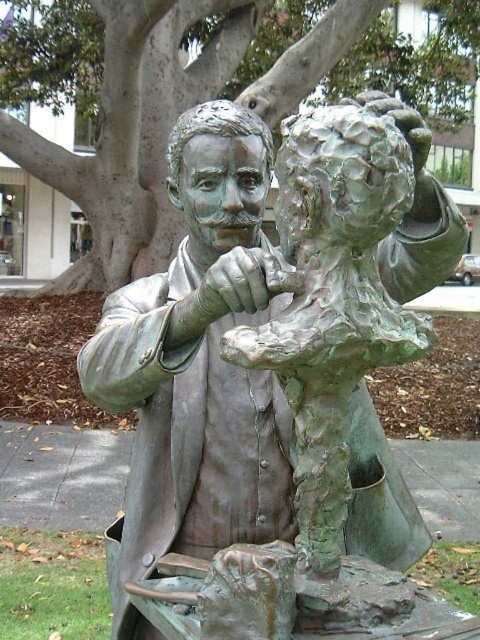
Question: Does green patina bronze statue at center appear on the right side of green textured tree at upper center?

Choices:
 (A) no
 (B) yes

Answer: (A)

Question: Can you confirm if green patina bronze statue at center is wider than green textured tree at upper center?

Choices:
 (A) yes
 (B) no

Answer: (B)

Question: Among these points, which one is farthest from the camera?

Choices:
 (A) (266, 502)
 (B) (4, 35)

Answer: (B)

Question: Which object is farther from the camera taking this photo?

Choices:
 (A) green patina bronze statue at center
 (B) green textured tree at upper center

Answer: (B)

Question: Is green patina bronze statue at center below green textured tree at upper center?

Choices:
 (A) no
 (B) yes

Answer: (B)